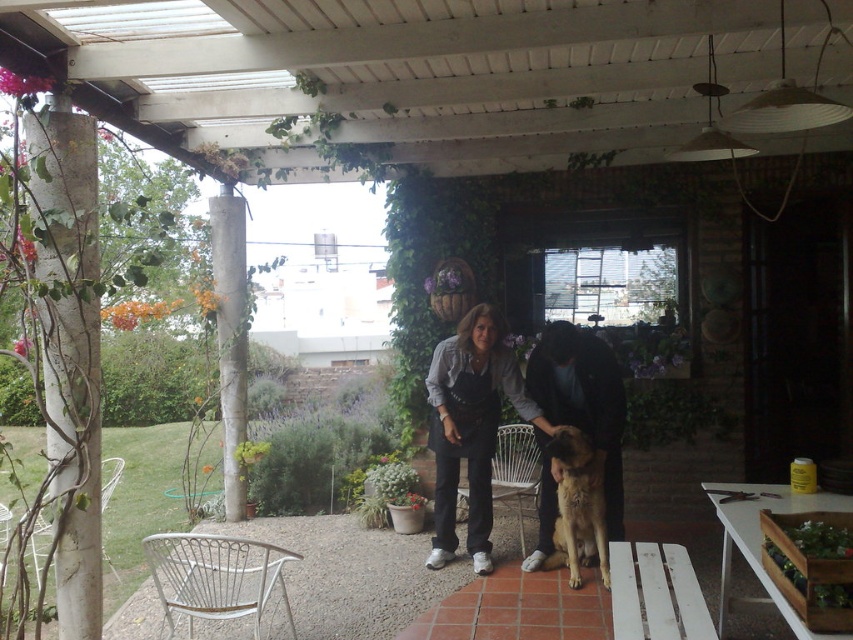
Question: Which object is farther from the camera taking this photo?

Choices:
 (A) golden fur dog at center
 (B) dark gray denim jacket at center

Answer: (B)

Question: Among these objects, which one is farthest from the camera?

Choices:
 (A) dark gray denim jacket at center
 (B) golden fur dog at center

Answer: (A)

Question: Does dark brown fur at center appear on the right side of golden fur dog at center?

Choices:
 (A) yes
 (B) no

Answer: (A)

Question: Does dark gray denim jacket at center appear on the right side of golden fur dog at center?

Choices:
 (A) yes
 (B) no

Answer: (B)

Question: Is dark gray denim jacket at center closer to camera compared to dark brown fur at center?

Choices:
 (A) yes
 (B) no

Answer: (B)

Question: Which object is the closest to the dark brown fur at center?

Choices:
 (A) dark gray denim jacket at center
 (B) golden fur dog at center

Answer: (A)